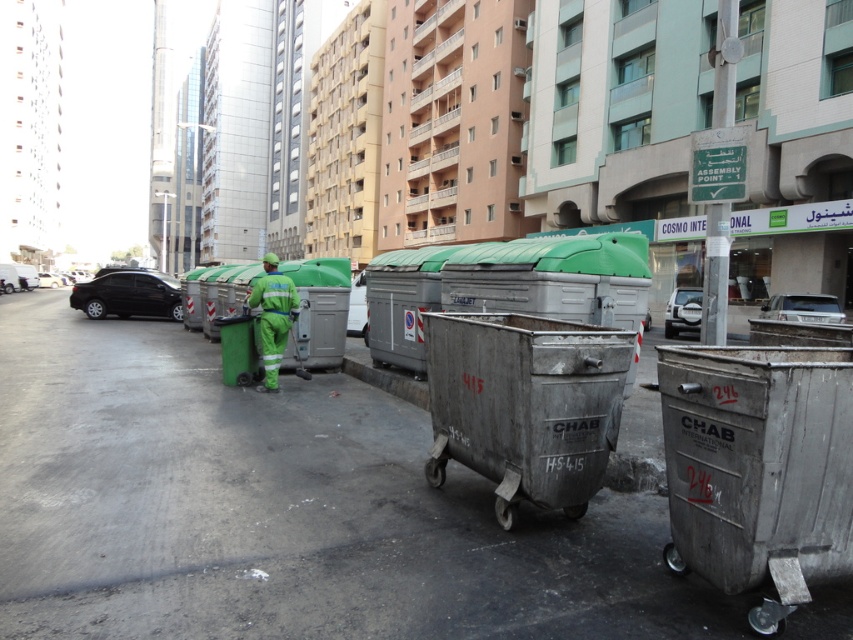
Question: Is metallic pavement at center thinner than metallic gray recycling bin at center?

Choices:
 (A) yes
 (B) no

Answer: (B)

Question: Does metallic pavement at center have a lesser width compared to green plastic garbage at center?

Choices:
 (A) yes
 (B) no

Answer: (B)

Question: Which of the following is the closest to the observer?

Choices:
 (A) green plastic garbage at center
 (B) metallic gray recycling bin at center
 (C) gray metallic trash can at right

Answer: (C)

Question: Which of the following is the farthest from the observer?

Choices:
 (A) (572, 348)
 (B) (341, 300)
 (C) (660, 371)

Answer: (B)

Question: Does gray metallic trash can at right have a larger size compared to green plastic garbage at center?

Choices:
 (A) no
 (B) yes

Answer: (B)

Question: Among these points, which one is farthest from the camera?

Choices:
 (A) (206, 356)
 (B) (287, 356)
 (C) (827, 579)

Answer: (A)